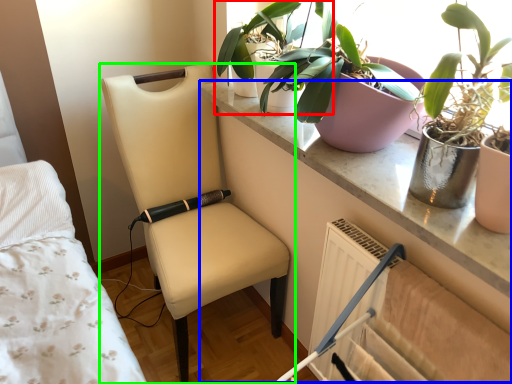
Question: Considering the real-world distances, which object is closest to houseplant (highlighted by a red box)? table (highlighted by a blue box) or chair (highlighted by a green box).

Choices:
 (A) table
 (B) chair

Answer: (A)